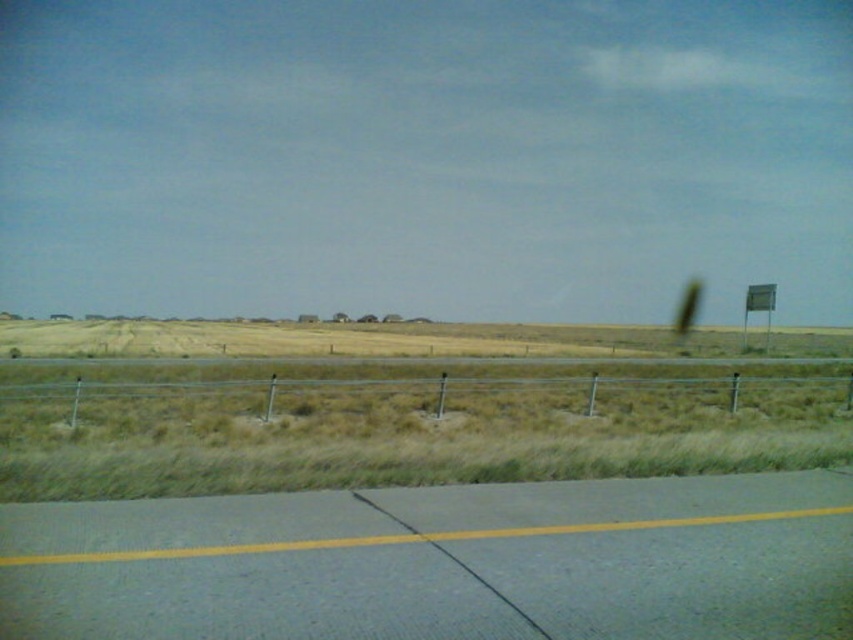
Between metallic wire fence at center and metallic sign at right, which one is positioned lower?

Positioned lower is metallic wire fence at center.

Is point (776, 369) closer to viewer compared to point (769, 294)?

Yes, it is.

Is point (114, 378) positioned in front of point (753, 285)?

Yes.

At what (x,y) coordinates should I click in order to perform the action: click on metallic wire fence at center. Please return your answer as a coordinate pair (x, y). Looking at the image, I should click on (421, 392).

Which of these two, asphalt road at lower center or metallic sign at right, stands shorter?

With less height is asphalt road at lower center.

The width and height of the screenshot is (853, 640). Find the location of `asphalt road at lower center`. asphalt road at lower center is located at coordinates point(438,563).

Which is more to the right, asphalt road at lower center or metallic wire fence at center?

metallic wire fence at center

Does asphalt road at lower center appear under metallic wire fence at center?

No.

At what (x,y) coordinates should I click in order to perform the action: click on asphalt road at lower center. Please return your answer as a coordinate pair (x, y). The image size is (853, 640). Looking at the image, I should click on (438, 563).